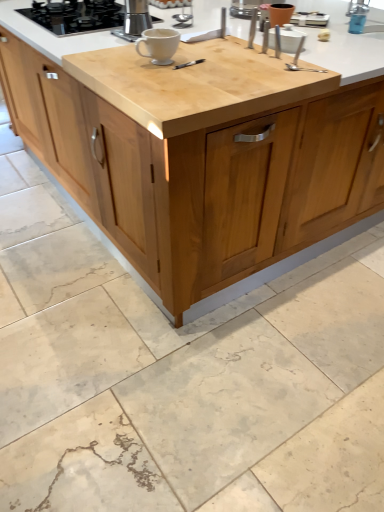
Question: Is blue plastic faucet at upper right further to camera compared to light brown wood cabinet at center?

Choices:
 (A) yes
 (B) no

Answer: (A)

Question: Does blue plastic faucet at upper right appear on the left side of light brown wood cabinet at center?

Choices:
 (A) yes
 (B) no

Answer: (B)

Question: From a real-world perspective, is blue plastic faucet at upper right physically above light brown wood cabinet at center?

Choices:
 (A) yes
 (B) no

Answer: (A)

Question: Are blue plastic faucet at upper right and light brown wood cabinet at center making contact?

Choices:
 (A) no
 (B) yes

Answer: (A)

Question: Considering the relative sizes of blue plastic faucet at upper right and light brown wood cabinet at center in the image provided, is blue plastic faucet at upper right bigger than light brown wood cabinet at center?

Choices:
 (A) yes
 (B) no

Answer: (B)

Question: Would you say white glossy mug at center is to the left or to the right of satin silver spoon at upper right in the picture?

Choices:
 (A) left
 (B) right

Answer: (A)

Question: Is point (165, 47) closer or farther from the camera than point (322, 70)?

Choices:
 (A) closer
 (B) farther

Answer: (A)

Question: Is white glossy mug at center inside the boundaries of satin silver spoon at upper right, or outside?

Choices:
 (A) outside
 (B) inside

Answer: (A)

Question: From a real-world perspective, is white glossy mug at center physically located above or below satin silver spoon at upper right?

Choices:
 (A) above
 (B) below

Answer: (A)

Question: Considering their positions, is white glossy mug at center located in front of or behind satin silver espresso maker at upper center?

Choices:
 (A) front
 (B) behind

Answer: (A)

Question: Is point (152, 59) closer or farther from the camera than point (130, 5)?

Choices:
 (A) closer
 (B) farther

Answer: (A)

Question: Is white glossy mug at center wider or thinner than satin silver espresso maker at upper center?

Choices:
 (A) thin
 (B) wide

Answer: (B)

Question: From a real-world perspective, relative to satin silver espresso maker at upper center, is white glossy mug at center vertically above or below?

Choices:
 (A) above
 (B) below

Answer: (B)

Question: Is black glass gas stove at upper left inside the boundaries of light brown wood cabinet at center, or outside?

Choices:
 (A) inside
 (B) outside

Answer: (A)

Question: Considering the positions of black glass gas stove at upper left and light brown wood cabinet at center in the image, is black glass gas stove at upper left wider or thinner than light brown wood cabinet at center?

Choices:
 (A) wide
 (B) thin

Answer: (B)